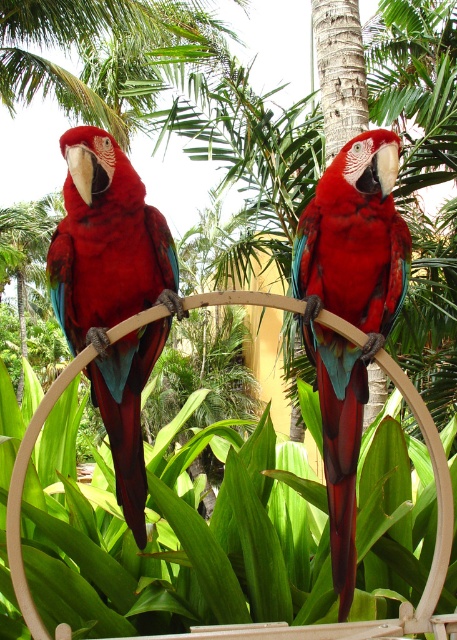
Question: Can you confirm if matte red parrot at left is thinner than shiny red parrot at center?

Choices:
 (A) no
 (B) yes

Answer: (A)

Question: Is matte red parrot at left bigger than shiny red parrot at center?

Choices:
 (A) no
 (B) yes

Answer: (B)

Question: Is matte red parrot at left bigger than shiny red parrot at center?

Choices:
 (A) yes
 (B) no

Answer: (A)

Question: Among these objects, which one is farthest from the camera?

Choices:
 (A) matte red parrot at left
 (B) shiny red parrot at center

Answer: (B)

Question: Among these points, which one is nearest to the camera?

Choices:
 (A) (105, 204)
 (B) (343, 346)

Answer: (A)

Question: Which point is closer to the camera?

Choices:
 (A) matte red parrot at left
 (B) shiny red parrot at center

Answer: (A)